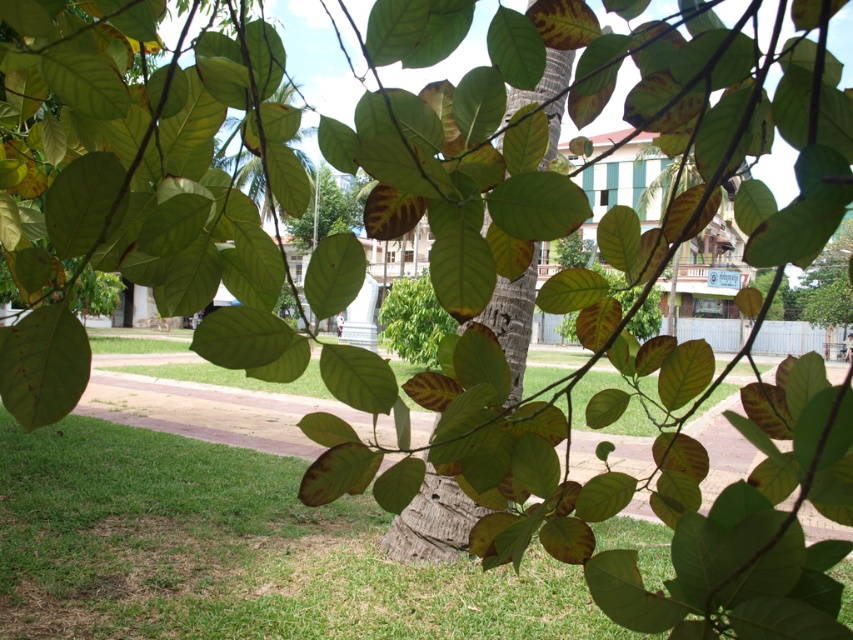
Based on the photo, which is more to the left, green grass at lower left or brown rough tree trunk at center?

green grass at lower left

You are a GUI agent. You are given a task and a screenshot of the screen. Output one action in this format:
    pyautogui.click(x=<x>, y=<y>)
    Task: Click on the green grass at lower left
    This screenshot has height=640, width=853.
    Given the screenshot: What is the action you would take?
    pyautogui.click(x=202, y=544)

Does point (231, 548) come closer to viewer compared to point (531, 330)?

No, it is not.

Locate an element on the screen. The image size is (853, 640). green grass at lower left is located at coordinates (202, 544).